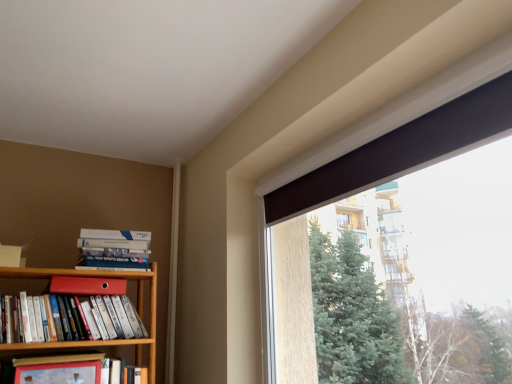
What do you see at coordinates (87, 285) in the screenshot? I see `matte red folder at upper left, which is counted as the 1th paperback book, starting from the back` at bounding box center [87, 285].

Image resolution: width=512 pixels, height=384 pixels. What do you see at coordinates (114, 248) in the screenshot?
I see `hardcover books at left, the 3th book positioned from the bottom` at bounding box center [114, 248].

What is the approximate width of hardcover book at left, positioned as the 1th paperback book in bottom-to-top order?

The width of hardcover book at left, positioned as the 1th paperback book in bottom-to-top order, is 1.94 inches.

The image size is (512, 384). Identify the location of matte red folder at upper left, the 2th paperback book when ordered from front to back. (87, 285).

From a real-world perspective, is hardcover books at left, marked as the 1th book in a top-to-bottom arrangement, physically above matte red folder at upper left, the 2th paperback book when ordered from front to back?

Yes.

Between point (120, 232) and point (50, 282), which one is positioned behind?

The point (120, 232) is more distant.

This screenshot has width=512, height=384. I want to click on paperback book that is the 1st object directly below the hardcover books at left, marked as the 1th book in a top-to-bottom arrangement (from a real-world perspective), so click(x=87, y=285).

Is hardcover book at left, the 1th paperback book positioned from the front, turned away from hardcover books at left, the 3th book positioned from the bottom?

No.

From their relative heights in the image, would you say hardcover book at left, the 1th paperback book positioned from the front, is taller or shorter than hardcover books at left, the 3th book positioned from the bottom?

In the image, hardcover book at left, the 1th paperback book positioned from the front, appears to be taller than hardcover books at left, the 3th book positioned from the bottom.

Can you confirm if hardcover book at left, the 1th paperback book positioned from the front, is thinner than hardcover books at left, marked as the 1th book in a top-to-bottom arrangement?

Yes, hardcover book at left, the 1th paperback book positioned from the front, is thinner than hardcover books at left, marked as the 1th book in a top-to-bottom arrangement.

Is hardcover book at left, positioned as the 1th paperback book in bottom-to-top order, in front of or behind hardcover books at left, marked as the 1th book in a top-to-bottom arrangement, in the image?

Visually, hardcover book at left, positioned as the 1th paperback book in bottom-to-top order, is located in front of hardcover books at left, marked as the 1th book in a top-to-bottom arrangement.

Is brown matte window at upper right far away from matte red folder at upper left, the 1th paperback book from the top?

Indeed, brown matte window at upper right is not near matte red folder at upper left, the 1th paperback book from the top.

Does brown matte window at upper right lie in front of matte red folder at upper left, the 1th paperback book from the top?

Yes.

Who is shorter, brown matte window at upper right or matte red folder at upper left, the 2th paperback book when ordered from front to back?

matte red folder at upper left, the 2th paperback book when ordered from front to back.

From a real-world perspective, is brown matte window at upper right above or below matte red folder at upper left, which is the second paperback book from bottom to top?

Clearly, from a real-world perspective, brown matte window at upper right is above matte red folder at upper left, which is the second paperback book from bottom to top.

Would you say matte red folder at upper left, which is the second paperback book from bottom to top, is to the left or to the right of matte red bookshelf at left, positioned as the second book in top-to-bottom order, in the picture?

Based on their positions, matte red folder at upper left, which is the second paperback book from bottom to top, is located to the right of matte red bookshelf at left, positioned as the second book in top-to-bottom order.

Considering the relative positions of matte red folder at upper left, which is the second paperback book from bottom to top, and matte red bookshelf at left, which ranks as the second book in bottom-to-top order, in the image provided, is matte red folder at upper left, which is the second paperback book from bottom to top, behind matte red bookshelf at left, which ranks as the second book in bottom-to-top order,?

Yes, it is.

Measure the distance from matte red folder at upper left, the 2th paperback book when ordered from front to back, to matte red bookshelf at left, which ranks as the second book in bottom-to-top order.

matte red folder at upper left, the 2th paperback book when ordered from front to back, is 4.61 inches from matte red bookshelf at left, which ranks as the second book in bottom-to-top order.

From the image's perspective, is matte red folder at upper left, which is the second paperback book from bottom to top, above or below matte red bookshelf at left, which ranks as the second book in bottom-to-top order?

Based on their image positions, matte red folder at upper left, which is the second paperback book from bottom to top, is located above matte red bookshelf at left, which ranks as the second book in bottom-to-top order.

Is hardcover book at left, which is the 1th book in bottom-to-top order, in contact with matte red bookshelf at left, which ranks as the second book in bottom-to-top order?

hardcover book at left, which is the 1th book in bottom-to-top order, is not next to matte red bookshelf at left, which ranks as the second book in bottom-to-top order, and they're not touching.

Where is `the 1st book behind the matte red bookshelf at left, positioned as the second book in top-to-bottom order, starting your count from the anchor`? The height and width of the screenshot is (384, 512). the 1st book behind the matte red bookshelf at left, positioned as the second book in top-to-bottom order, starting your count from the anchor is located at coordinates point(123,373).

Which of these two, hardcover book at left, which is counted as the third book, starting from the top, or matte red bookshelf at left, which ranks as the second book in bottom-to-top order, stands shorter?

matte red bookshelf at left, which ranks as the second book in bottom-to-top order, is shorter.

Considering the sizes of objects hardcover book at left, which is the 1th book in bottom-to-top order, and matte red bookshelf at left, which ranks as the second book in bottom-to-top order, in the image provided, who is bigger, hardcover book at left, which is the 1th book in bottom-to-top order, or matte red bookshelf at left, which ranks as the second book in bottom-to-top order,?

Bigger between the two is matte red bookshelf at left, which ranks as the second book in bottom-to-top order.

Measure the distance between hardcover book at left, which is the second paperback book from top to bottom, and matte red folder at upper left, which is counted as the 1th paperback book, starting from the back.

32.97 centimeters.

Which is in front, point (52, 376) or point (52, 284)?

Point (52, 376)

Where is `paperback book below the matte red folder at upper left, the 1th paperback book from the top (from the image's perspective)`? Image resolution: width=512 pixels, height=384 pixels. paperback book below the matte red folder at upper left, the 1th paperback book from the top (from the image's perspective) is located at coordinates (60, 373).

Is hardcover book at left, which is counted as the third book, starting from the top, aimed at matte red folder at upper left, which is counted as the 1th paperback book, starting from the back?

No, hardcover book at left, which is counted as the third book, starting from the top, is not oriented towards matte red folder at upper left, which is counted as the 1th paperback book, starting from the back.

Is hardcover book at left, which is counted as the third book, starting from the top, not close to matte red folder at upper left, which is the second paperback book from bottom to top?

Actually, hardcover book at left, which is counted as the third book, starting from the top, and matte red folder at upper left, which is the second paperback book from bottom to top, are a little close together.

Based on the photo, from a real-world perspective, is hardcover book at left, which is counted as the third book, starting from the top, beneath matte red folder at upper left, the 2th paperback book when ordered from front to back?

Correct, in the physical world, hardcover book at left, which is counted as the third book, starting from the top, is lower than matte red folder at upper left, the 2th paperback book when ordered from front to back.

Is hardcover book at left, which is counted as the third book, starting from the top, taller than matte red folder at upper left, which is the second paperback book from bottom to top?

Correct, hardcover book at left, which is counted as the third book, starting from the top, is much taller as matte red folder at upper left, which is the second paperback book from bottom to top.

From the image's perspective, starting from the hardcover books at left, the 3th book positioned from the bottom, which paperback book is the 1st one below? Please provide its 2D coordinates.

[(87, 285)]

Find the location of a particular element. The height and width of the screenshot is (384, 512). the 1st book to the right when counting from the hardcover book at left, which is the second paperback book from top to bottom is located at coordinates (114, 248).

Based on their spatial positions, is brown matte window at upper right or hardcover books at left, marked as the 1th book in a top-to-bottom arrangement, further from matte red bookshelf at left, which ranks as the second book in bottom-to-top order?

brown matte window at upper right is further to matte red bookshelf at left, which ranks as the second book in bottom-to-top order.

Considering their positions, is hardcover books at left, the 3th book positioned from the bottom, positioned closer to hardcover book at left, which is counted as the third book, starting from the top, than hardcover book at left, positioned as the 1th paperback book in bottom-to-top order?

Based on the image, hardcover book at left, positioned as the 1th paperback book in bottom-to-top order, appears to be nearer to hardcover book at left, which is counted as the third book, starting from the top.

From the picture: Which object lies further to the anchor point hardcover books at left, the 3th book positioned from the bottom, hardcover book at left, which is the second paperback book from top to bottom, or brown matte window at upper right?

brown matte window at upper right is further to hardcover books at left, the 3th book positioned from the bottom.

Considering their positions, is matte red bookshelf at left, positioned as the second book in top-to-bottom order, positioned further to hardcover book at left, which is counted as the third book, starting from the top, than hardcover books at left, the 3th book positioned from the bottom?

hardcover books at left, the 3th book positioned from the bottom, is further to hardcover book at left, which is counted as the third book, starting from the top.

Consider the image. From the image, which object appears to be nearer to hardcover book at left, which is the second paperback book from top to bottom, matte red bookshelf at left, which ranks as the second book in bottom-to-top order, or matte red folder at upper left, which is counted as the 1th paperback book, starting from the back?

Based on the image, matte red bookshelf at left, which ranks as the second book in bottom-to-top order, appears to be nearer to hardcover book at left, which is the second paperback book from top to bottom.

Considering their positions, is hardcover books at left, marked as the 1th book in a top-to-bottom arrangement, positioned closer to matte red bookshelf at left, positioned as the second book in top-to-bottom order, than brown matte window at upper right?

hardcover books at left, marked as the 1th book in a top-to-bottom arrangement, lies closer to matte red bookshelf at left, positioned as the second book in top-to-bottom order, than the other object.

Based on their spatial positions, is matte red folder at upper left, which is counted as the 1th paperback book, starting from the back, or brown matte window at upper right closer to matte red bookshelf at left, which ranks as the second book in bottom-to-top order?

matte red folder at upper left, which is counted as the 1th paperback book, starting from the back, is closer to matte red bookshelf at left, which ranks as the second book in bottom-to-top order.

Based on their spatial positions, is hardcover book at left, arranged as the 2th paperback book when viewed from the back, or brown matte window at upper right closer to matte red folder at upper left, the 2th paperback book when ordered from front to back?

hardcover book at left, arranged as the 2th paperback book when viewed from the back, is positioned closer to the anchor matte red folder at upper left, the 2th paperback book when ordered from front to back.

The image size is (512, 384). What are the coordinates of `book that lies between hardcover books at left, marked as the 1th book in a top-to-bottom arrangement, and hardcover book at left, which is counted as the third book, starting from the top, from top to bottom` in the screenshot? It's located at (67, 318).

Find the location of `book between hardcover books at left, the 3th book positioned from the bottom, and hardcover book at left, which is the second paperback book from top to bottom, in the vertical direction`. book between hardcover books at left, the 3th book positioned from the bottom, and hardcover book at left, which is the second paperback book from top to bottom, in the vertical direction is located at coordinates (67, 318).

Identify the location of paperback book between matte red folder at upper left, which is counted as the 1th paperback book, starting from the back, and hardcover book at left, which is the 1th book in bottom-to-top order, in the vertical direction. (60, 373).

This screenshot has height=384, width=512. I want to click on paperback book between matte red bookshelf at left, positioned as the second book in top-to-bottom order, and hardcover book at left, which is the 1th book in bottom-to-top order, vertically, so click(x=60, y=373).